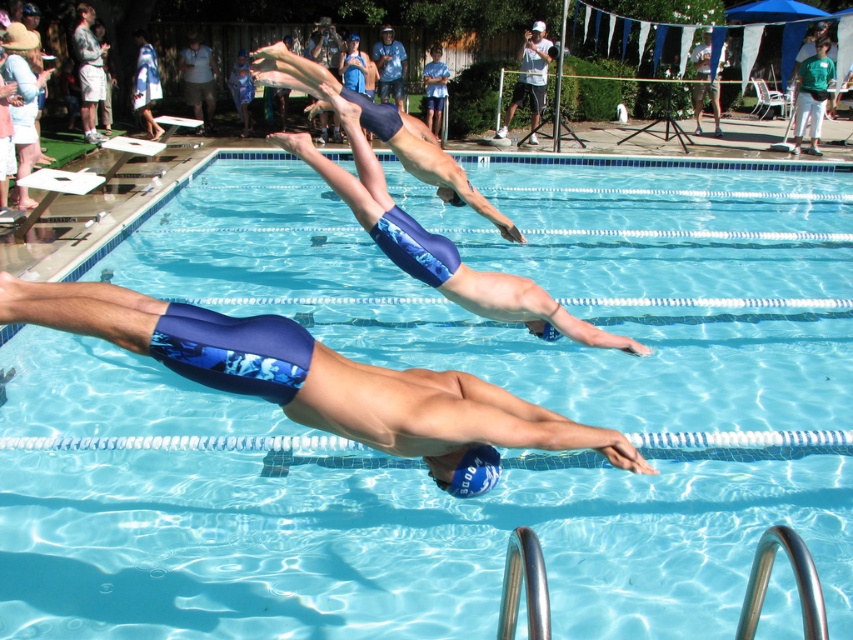
Question: Is white matte camera at upper center below blue fabric shorts at upper center?

Choices:
 (A) yes
 (B) no

Answer: (A)

Question: Considering the real-world distances, which object is closest to the blue fabric towel at upper left?

Choices:
 (A) gray cotton shirt at upper left
 (B) blue fabric shorts at upper center
 (C) blue textured swim cap at upper center
 (D) blue fabric shorts at center

Answer: (A)

Question: Among these objects, which one is nearest to the camera?

Choices:
 (A) white matte camera at upper center
 (B) blue fabric towel at upper left

Answer: (B)

Question: Is blue neoprene swim cap at center to the right of blue fabric shorts at center from the viewer's perspective?

Choices:
 (A) no
 (B) yes

Answer: (A)

Question: Where is blue neoprene swim cap at center located in relation to blue fabric towel at upper left in the image?

Choices:
 (A) right
 (B) left

Answer: (A)

Question: Which object appears closest to the camera in this image?

Choices:
 (A) white matte camera at upper center
 (B) blue fabric towel at upper left

Answer: (B)